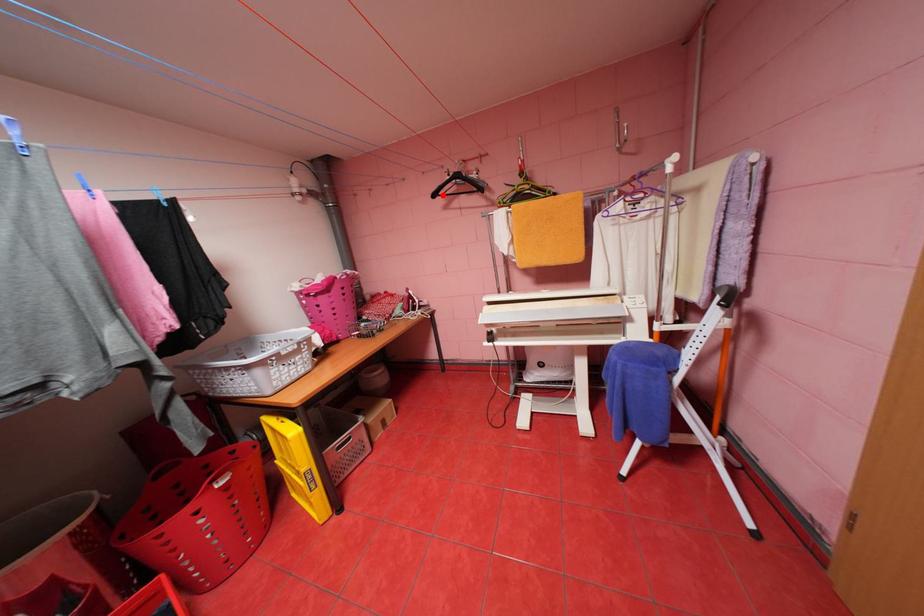
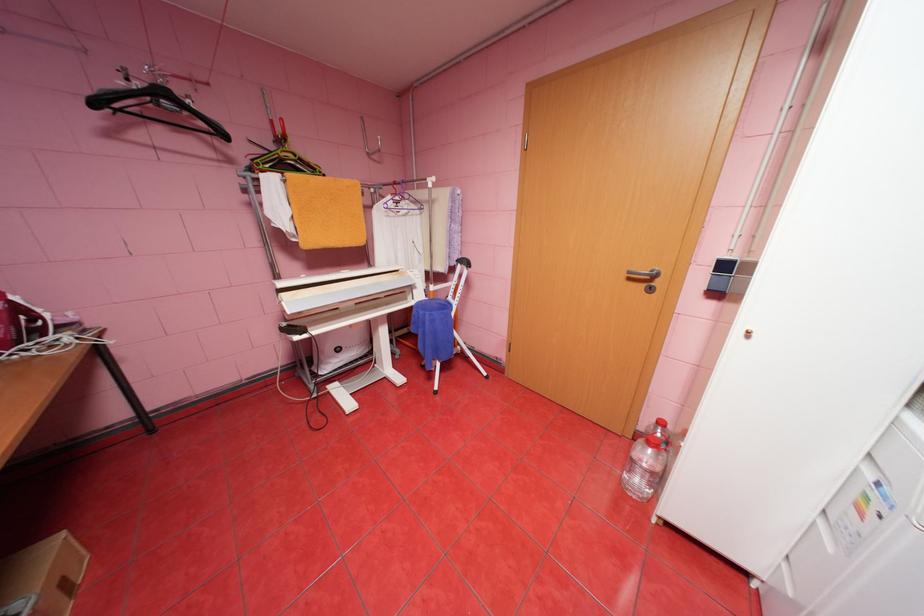
Question: I am providing you with two images of the same scene from different viewpoints. Given a red point in image1, look at the same physical point in image2. Is it:

Choices:
 (A) Closer to the viewpoint
 (B) Farther from the viewpoint

Answer: (B)